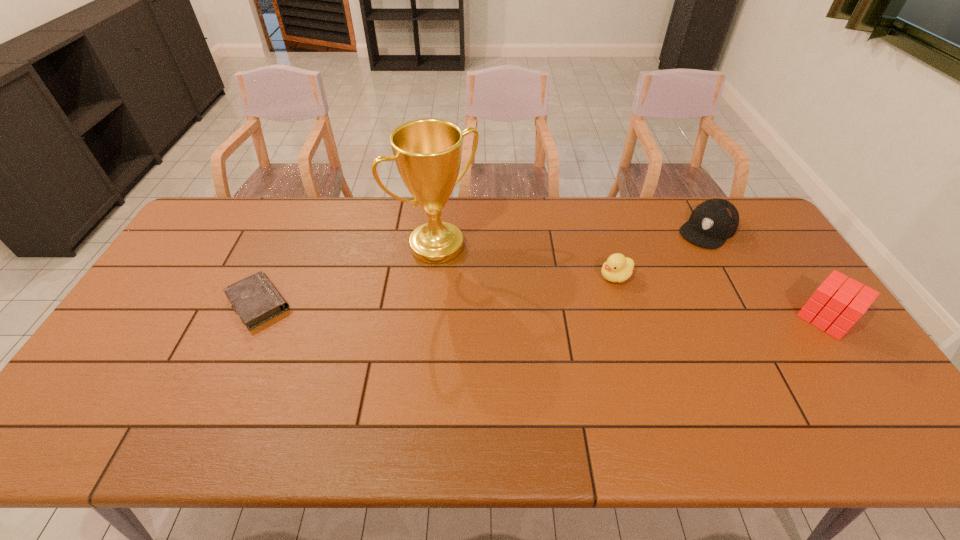
Find the location of a particular element. The height and width of the screenshot is (540, 960). vacant space located 0.110m on the front-facing side of the second object from right to left is located at coordinates (674, 259).

At what (x,y) coordinates should I click in order to perform the action: click on vacant space located on the front-facing side of the second object from right to left. Please return your answer as a coordinate pair (x, y). This screenshot has height=540, width=960. Looking at the image, I should click on (660, 271).

Where is `blank area located by the handles of the fourth object from right to left`? The height and width of the screenshot is (540, 960). blank area located by the handles of the fourth object from right to left is located at coordinates (539, 349).

What are the coordinates of `vacant space situated 0.150m by the handles of the fourth object from right to left` in the screenshot? It's located at (487, 293).

This screenshot has height=540, width=960. Find the location of `blank space located by the handles of the fourth object from right to left`. blank space located by the handles of the fourth object from right to left is located at coordinates (507, 314).

The height and width of the screenshot is (540, 960). In order to click on vacant space located 0.240m on the beak of the third object from right to left in this screenshot , I will do `click(537, 313)`.

The height and width of the screenshot is (540, 960). Find the location of `free point located on the beak of the third object from right to left`. free point located on the beak of the third object from right to left is located at coordinates (545, 308).

Locate an element on the screen. free location located on the beak of the third object from right to left is located at coordinates (579, 293).

Where is `cap at the far edge`? The image size is (960, 540). cap at the far edge is located at coordinates (712, 222).

Locate an element on the screen. The height and width of the screenshot is (540, 960). award present at the far edge is located at coordinates (427, 152).